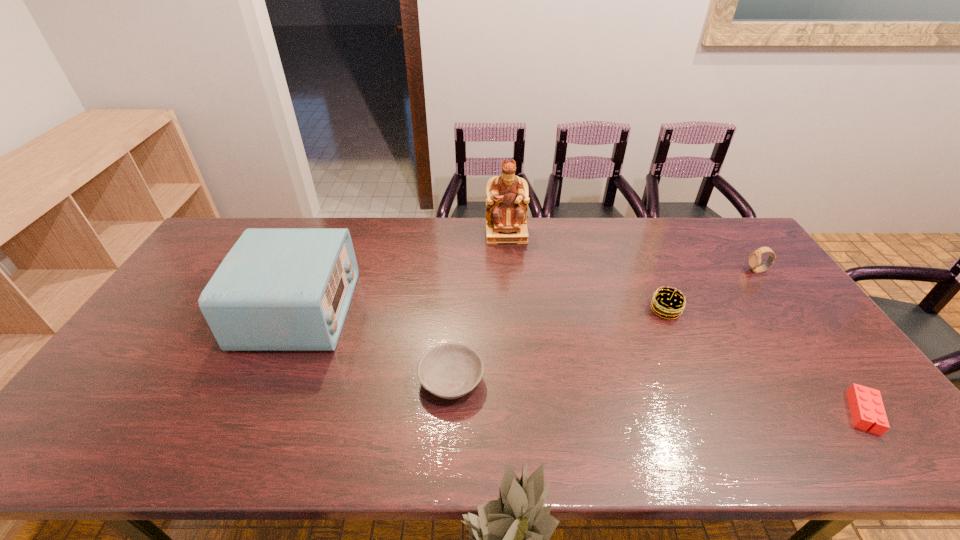
This screenshot has width=960, height=540. Identify the location of free spot between the fourth tallest object and the watch. (711, 291).

I want to click on vacant area that lies between the third object from right to left and the tallest object, so (586, 272).

What are the coordinates of `free space between the patty and the figurine` in the screenshot? It's located at (586, 272).

Identify the location of empty location between the third object from right to left and the radio receiver. (482, 310).

You are a GUI agent. You are given a task and a screenshot of the screen. Output one action in this format:
    pyautogui.click(x=<x>, y=<y>)
    Task: Click on the empty space that is in between the fourth shortest object and the fifth shortest object
    
    Given the screenshot: What is the action you would take?
    pyautogui.click(x=528, y=291)

Where is `free spot between the farthest object and the fourth object from left to right`? This screenshot has width=960, height=540. free spot between the farthest object and the fourth object from left to right is located at coordinates (586, 272).

I want to click on free space that is in between the watch and the fifth tallest object, so click(604, 326).

Identify which object is the third closest to the radio receiver. Please provide its 2D coordinates. Your answer should be formatted as a tuple, i.e. [(x, y)], where the tuple contains the x and y coordinates of a point satisfying the conditions above.

[(669, 302)]

Find the location of `object that stands as the fifth closest to the shortest object`. object that stands as the fifth closest to the shortest object is located at coordinates pos(278,289).

Where is `vacant region that satisfies the following two spatial constraints: 1. on the front-facing side of the shortest object; 2. on the right side of the fourth object from right to left`? The height and width of the screenshot is (540, 960). vacant region that satisfies the following two spatial constraints: 1. on the front-facing side of the shortest object; 2. on the right side of the fourth object from right to left is located at coordinates (520, 413).